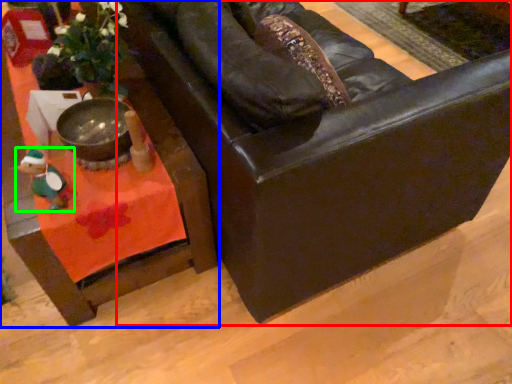
Question: Which object is the closest to the chair (highlighted by a red box)? Choose among these: table (highlighted by a blue box) or toy (highlighted by a green box).

Choices:
 (A) table
 (B) toy

Answer: (A)